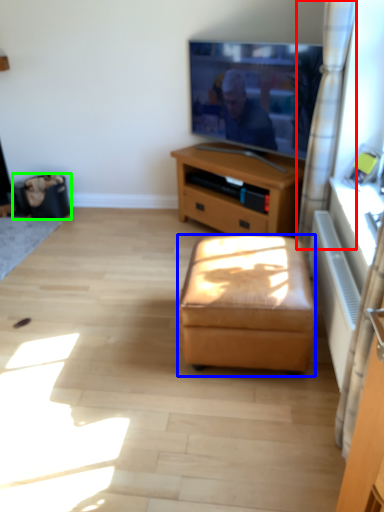
Question: Which is nearer to the curtain (highlighted by a red box)? stool (highlighted by a blue box) or trash bin/can (highlighted by a green box).

Choices:
 (A) stool
 (B) trash bin/can

Answer: (A)